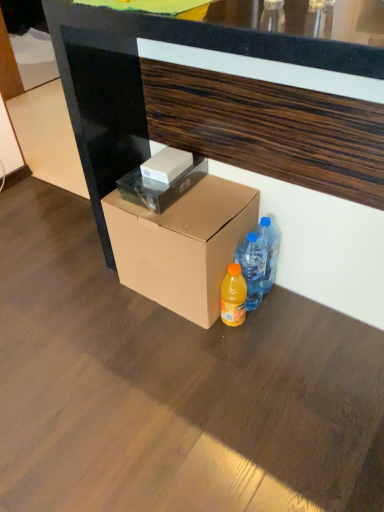
Question: Is translucent plastic bottle at lower right, which is the 1th bottle from left to right, at the right side of brown wood desk at center?

Choices:
 (A) no
 (B) yes

Answer: (A)

Question: Is translucent plastic bottle at lower right, the second bottle in the right-to-left sequence, thinner than brown wood desk at center?

Choices:
 (A) yes
 (B) no

Answer: (A)

Question: Is translucent plastic bottle at lower right, which is the 1th bottle from left to right, bigger than brown wood desk at center?

Choices:
 (A) no
 (B) yes

Answer: (A)

Question: Is brown wood desk at center at the back of translucent plastic bottle at lower right, the second bottle in the right-to-left sequence?

Choices:
 (A) no
 (B) yes

Answer: (B)

Question: Is translucent plastic bottle at lower right, which is the 1th bottle from left to right, smaller than brown wood desk at center?

Choices:
 (A) no
 (B) yes

Answer: (B)

Question: From the image's perspective, would you say translucent plastic bottle at lower right, the second bottle in the right-to-left sequence, is shown under brown wood desk at center?

Choices:
 (A) yes
 (B) no

Answer: (A)

Question: Is translucent plastic bottle at lower right, which is the 1th bottle from left to right, surrounded by white glossy box at center, marked as the second box in a top-to-bottom arrangement?

Choices:
 (A) no
 (B) yes

Answer: (A)

Question: Can you confirm if white glossy box at center, marked as the second box in a top-to-bottom arrangement, is shorter than translucent plastic bottle at lower right, the second bottle in the right-to-left sequence?

Choices:
 (A) yes
 (B) no

Answer: (A)

Question: Does white glossy box at center, placed as the 2th box when sorted from bottom to top, turn towards translucent plastic bottle at lower right, the second bottle in the right-to-left sequence?

Choices:
 (A) yes
 (B) no

Answer: (B)

Question: From a real-world perspective, is white glossy box at center, marked as the second box in a top-to-bottom arrangement, located higher than translucent plastic bottle at lower right, which is the 1th bottle from left to right?

Choices:
 (A) yes
 (B) no

Answer: (A)

Question: Can you see white glossy box at center, placed as the 2th box when sorted from bottom to top, touching translucent plastic bottle at lower right, the second bottle in the right-to-left sequence?

Choices:
 (A) no
 (B) yes

Answer: (A)

Question: Does white glossy box at center, placed as the 2th box when sorted from bottom to top, lie behind translucent plastic bottle at lower right, the second bottle in the right-to-left sequence?

Choices:
 (A) yes
 (B) no

Answer: (B)

Question: Considering the relative sizes of brown cardboard box at lower center, the first box ordered from the bottom, and translucent plastic bottle at lower right, the second bottle in the right-to-left sequence, in the image provided, is brown cardboard box at lower center, the first box ordered from the bottom, taller than translucent plastic bottle at lower right, the second bottle in the right-to-left sequence,?

Choices:
 (A) no
 (B) yes

Answer: (B)